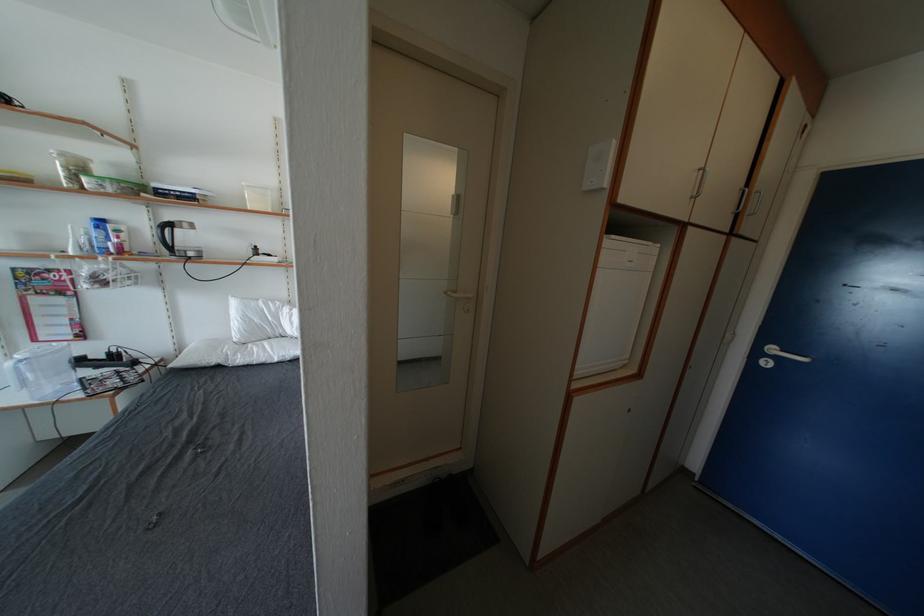
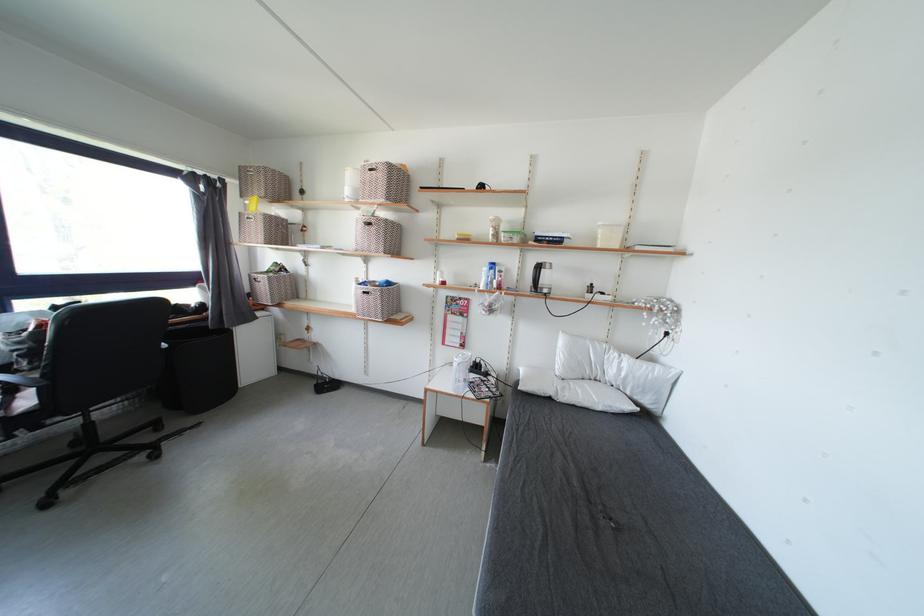
Where in the second image is the point corresponding to (x=162, y=190) from the first image?

(543, 238)